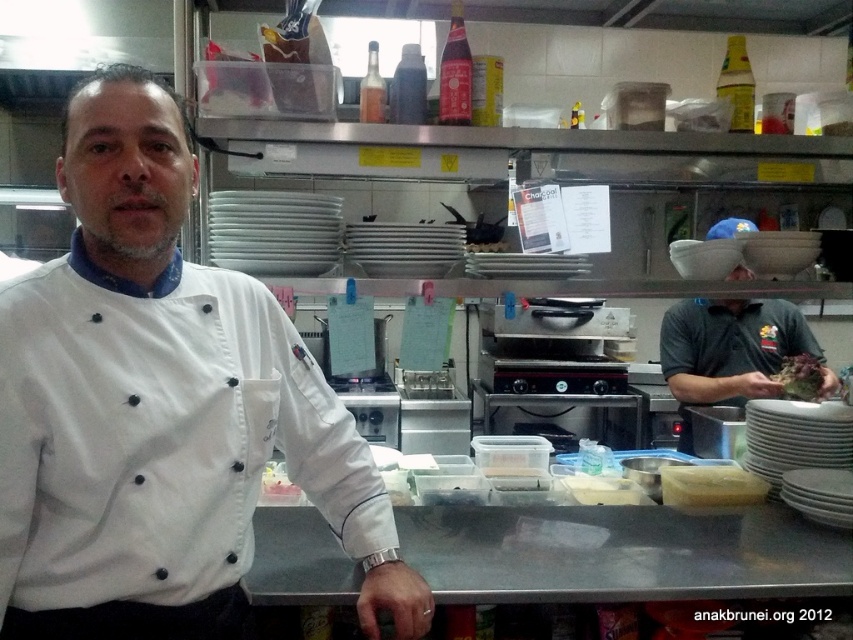
Which is more to the right, white matte chef coat at center or green leafy vegetable at center?

green leafy vegetable at center is more to the right.

What are the coordinates of `white matte chef coat at center` in the screenshot? It's located at (160, 410).

Can you confirm if yellow matte cheese at center is positioned above green leafy vegetable at center?

No, yellow matte cheese at center is not above green leafy vegetable at center.

Is point (683, 476) positioned in front of point (780, 378)?

Yes, point (683, 476) is in front of point (780, 378).

Is point (728, 493) less distant than point (811, 385)?

Yes, point (728, 493) is in front of point (811, 385).

At what (x,y) coordinates should I click in order to perform the action: click on yellow matte cheese at center. Please return your answer as a coordinate pair (x, y). Looking at the image, I should click on (711, 484).

Can you confirm if green leafy vegetable at center is smaller than brown matte food at center?

No.

Which is in front, point (793, 358) or point (496, 241)?

Point (793, 358) is more forward.

Where is `green leafy vegetable at center`? This screenshot has height=640, width=853. green leafy vegetable at center is located at coordinates (799, 376).

You are a GUI agent. You are given a task and a screenshot of the screen. Output one action in this format:
    pyautogui.click(x=<x>, y=<y>)
    Task: Click on the green leafy vegetable at center
    This screenshot has width=853, height=640.
    Given the screenshot: What is the action you would take?
    pyautogui.click(x=799, y=376)